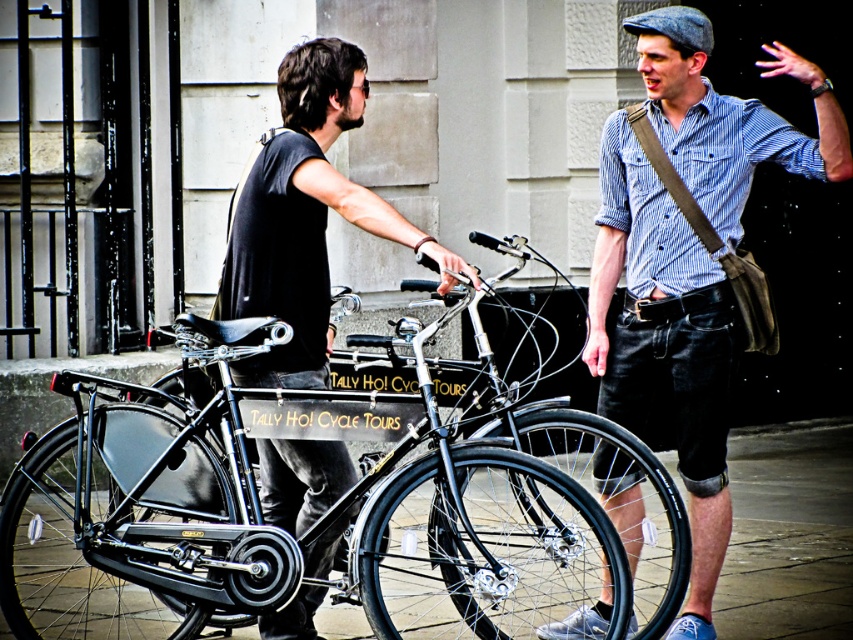
Image resolution: width=853 pixels, height=640 pixels. I want to click on matte black bicycle at center, so click(x=305, y=216).

Can you confirm if matte black bicycle at center is thinner than black rubber pavement at lower center?

Correct, matte black bicycle at center's width is less than black rubber pavement at lower center's.

Where is `matte black bicycle at center`? matte black bicycle at center is located at coordinates (305, 216).

The width and height of the screenshot is (853, 640). I want to click on matte black bicycle at center, so click(x=305, y=216).

Is black matte bicycle at center below matte black bicycle at center?

Yes, black matte bicycle at center is below matte black bicycle at center.

This screenshot has width=853, height=640. In order to click on black matte bicycle at center in this screenshot , I will do `click(292, 531)`.

Does striped cotton shirt at center have a smaller size compared to black rubber pavement at lower center?

Yes.

Which is behind, point (646, 416) or point (827, 598)?

Point (827, 598)

Image resolution: width=853 pixels, height=640 pixels. I want to click on striped cotton shirt at center, so click(665, 342).